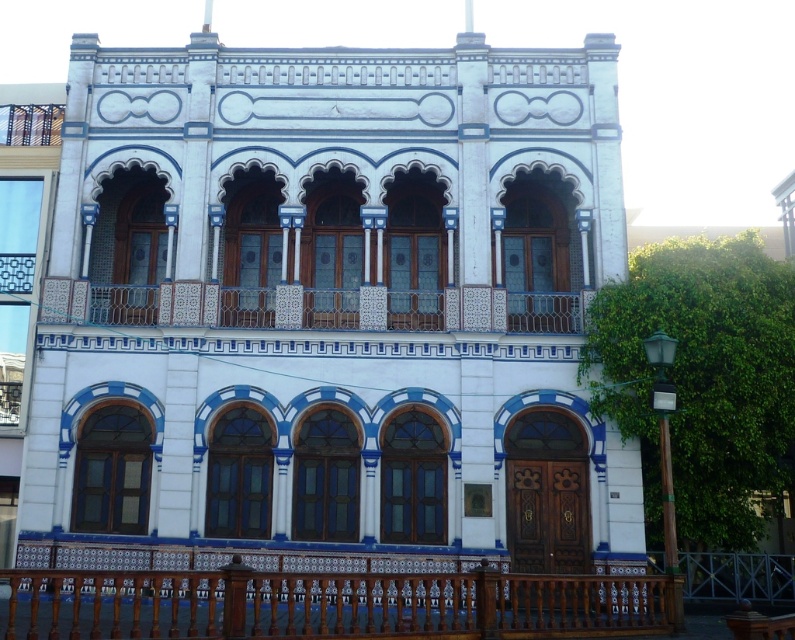
Question: Does brown wooden balustrade at lower center appear on the right side of white ceramic balcony at center?

Choices:
 (A) no
 (B) yes

Answer: (B)

Question: Which of the following is the closest to the observer?

Choices:
 (A) pos(88,307)
 (B) pos(208,618)

Answer: (B)

Question: Which of the following is the farthest from the observer?

Choices:
 (A) (53, 301)
 (B) (94, 609)

Answer: (A)

Question: Considering the relative positions of brown wooden balustrade at lower center and white ceramic balcony at center in the image provided, where is brown wooden balustrade at lower center located with respect to white ceramic balcony at center?

Choices:
 (A) right
 (B) left

Answer: (A)

Question: Can you confirm if brown wooden balustrade at lower center is positioned below white ceramic balcony at center?

Choices:
 (A) no
 (B) yes

Answer: (B)

Question: Which object appears closest to the camera in this image?

Choices:
 (A) brown wooden balustrade at lower center
 (B) white ceramic balcony at center

Answer: (A)